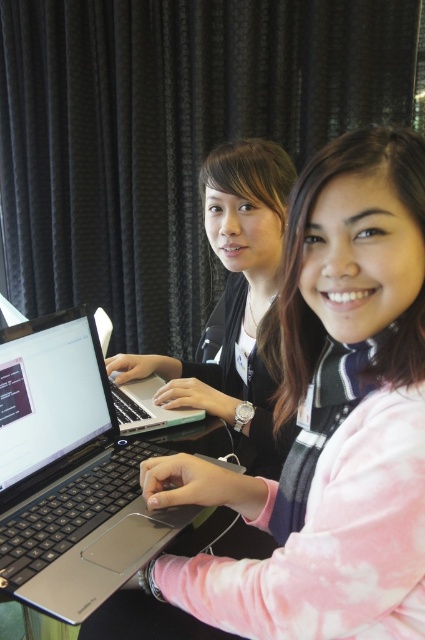
You are organizing a tech event and need to place two laptops on a table. You have a matte black laptop at center and a sleek silver laptop at center. Which one requires more space on the table?

The matte black laptop at center requires more space on the table because it has a larger size compared to the sleek silver laptop at center.

You are sitting at a table with two people using laptops. You need to place a small note on the table between the two points labeled point (373,480) and point (266,260). Based on their positions, which point is closer to you if you are facing the table?

Point (373,480) is in front of point (266,260), so if you are facing the table, point (373,480) is closer to you.

You are sitting at the table and want to place a small plant between the two points labeled as point (266,388) and point (153,429). Which point should the plant be closer to in order to be positioned between them?

The plant should be closer to point (153,429) because point (266,388) is behind point (153,429), so placing it closer to the front point ensures it is between them.